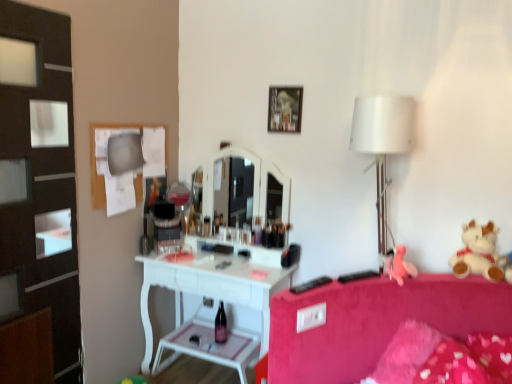
Question: From the image's perspective, is white plush teddy bear at right above or below matte glass bottle at center?

Choices:
 (A) above
 (B) below

Answer: (A)

Question: Considering the relative positions of white plush teddy bear at right and matte glass bottle at center in the image provided, is white plush teddy bear at right to the left or to the right of matte glass bottle at center?

Choices:
 (A) left
 (B) right

Answer: (B)

Question: Which of these objects is positioned closest to the black plastic remote control at lower right, which appears as the first remote control when viewed from the right?

Choices:
 (A) black plastic remote control at lower center, which is counted as the second remote control, starting from the right
 (B) matte glass bottle at center
 (C) wooden picture frame at upper center
 (D) pink fabric teddy bear at right
 (E) white plush teddy bear at right

Answer: (D)

Question: Considering the real-world distances, which object is closest to the black plastic remote control at lower right, positioned as the second remote control in left-to-right order?

Choices:
 (A) white plush teddy bear at right
 (B) black plastic remote control at lower center, which is counted as the second remote control, starting from the right
 (C) white fabric lampshade at right
 (D) wooden picture frame at upper center
 (E) pink fabric teddy bear at right

Answer: (E)